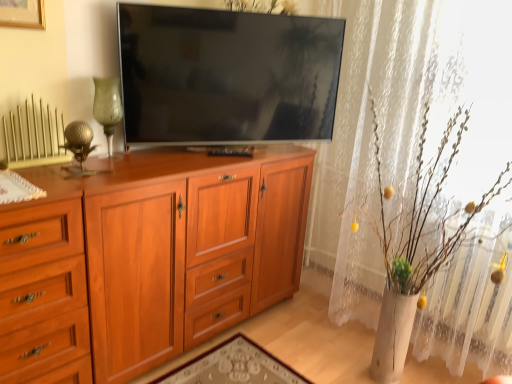
Question: Considering the positions of point (339, 11) and point (77, 216), is point (339, 11) closer or farther from the camera than point (77, 216)?

Choices:
 (A) farther
 (B) closer

Answer: (A)

Question: From a real-world perspective, relative to light brown wood drawer at left, is white lace curtain at upper right vertically above or below?

Choices:
 (A) above
 (B) below

Answer: (A)

Question: Which object is the farthest from the flat screen tv at center?

Choices:
 (A) gold metallic radiator at upper left
 (B) brushed gold picture frame at upper left
 (C) white lace curtain at upper right
 (D) light brown wood drawer at left
 (E) light brown wood cabinet at center

Answer: (D)

Question: Estimate the real-world distances between objects in this image. Which object is closer to the light brown wood cabinet at center?

Choices:
 (A) gold metallic radiator at upper left
 (B) light brown wood drawer at left
 (C) white lace curtain at upper right
 (D) flat screen tv at center
 (E) brushed gold picture frame at upper left

Answer: (B)